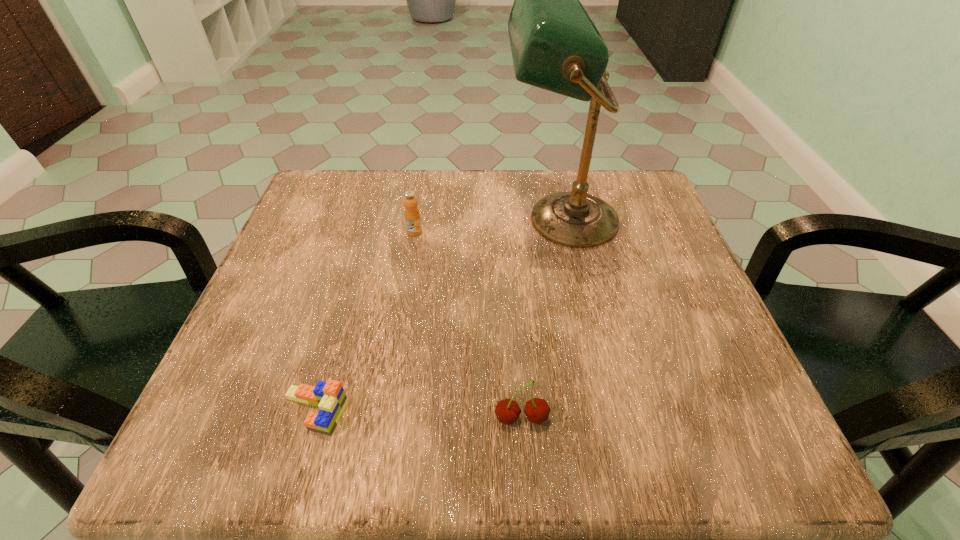
Find the location of a particular element. vacant space at the left edge of the desktop is located at coordinates (320, 239).

In the image, there is a desktop. At what (x,y) coordinates should I click in order to perform the action: click on vacant area at the right edge. Please return your answer as a coordinate pair (x, y). This screenshot has width=960, height=540. Looking at the image, I should click on (742, 387).

Identify the location of vacant space at the far left corner of the desktop. (312, 226).

I want to click on vacant space at the far right corner of the desktop, so click(621, 180).

You are a GUI agent. You are given a task and a screenshot of the screen. Output one action in this format:
    pyautogui.click(x=<x>, y=<y>)
    Task: Click on the vacant space that's between the leftmost object and the tallest object
    
    Given the screenshot: What is the action you would take?
    pyautogui.click(x=438, y=315)

Where is `free spot between the cherry and the orange juice`? The height and width of the screenshot is (540, 960). free spot between the cherry and the orange juice is located at coordinates [468, 325].

You are a GUI agent. You are given a task and a screenshot of the screen. Output one action in this format:
    pyautogui.click(x=<x>, y=<y>)
    Task: Click on the vacant area that lies between the shortest object and the orange juice
    The width and height of the screenshot is (960, 540).
    Given the screenshot: What is the action you would take?
    pyautogui.click(x=365, y=322)

The height and width of the screenshot is (540, 960). In order to click on empty space that is in between the third object from right to left and the cherry in this screenshot , I will do `click(468, 325)`.

The image size is (960, 540). Identify the location of free space that is in between the cherry and the Lego. (419, 415).

At what (x,y) coordinates should I click in order to perform the action: click on free space that is in between the cherry and the tallest object. Please return your answer as a coordinate pair (x, y). This screenshot has height=540, width=960. Looking at the image, I should click on (541, 319).